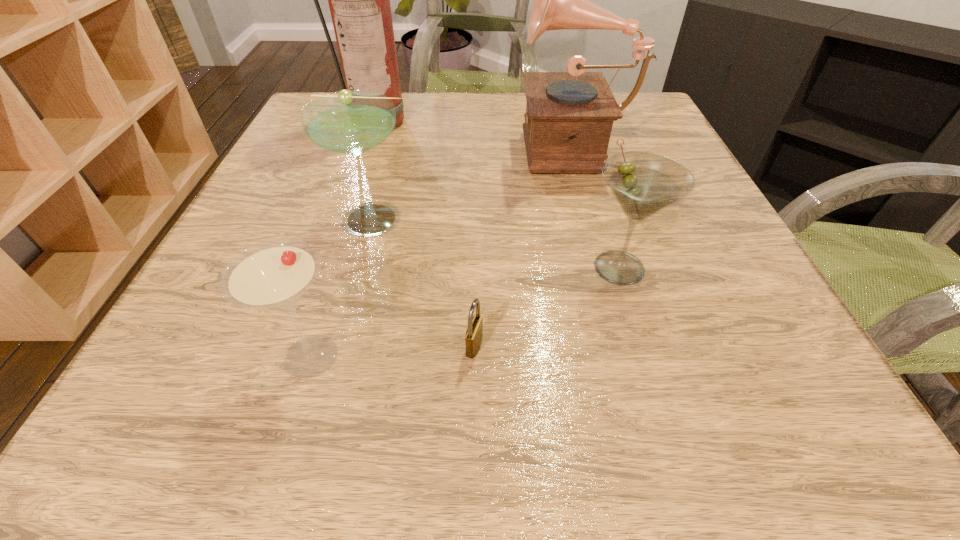
Find the location of a particular element. unoccupied position between the second tallest object and the padlock is located at coordinates (523, 245).

You are a GUI agent. You are given a task and a screenshot of the screen. Output one action in this format:
    pyautogui.click(x=<x>, y=<y>)
    Task: Click on the blank region between the nearest martini and the shortest object
    This screenshot has width=960, height=540.
    Given the screenshot: What is the action you would take?
    pyautogui.click(x=393, y=351)

Find the location of `free spot between the padlock and the second tallest object`. free spot between the padlock and the second tallest object is located at coordinates (523, 245).

Where is `free spot between the rightmost martini and the shortest object`? Image resolution: width=960 pixels, height=540 pixels. free spot between the rightmost martini and the shortest object is located at coordinates (547, 307).

Locate an element on the screen. Image resolution: width=960 pixels, height=540 pixels. free point between the shortest object and the record player is located at coordinates (523, 245).

This screenshot has height=540, width=960. In order to click on free space between the rightmost martini and the fourth object from left to right in this screenshot , I will do `click(547, 307)`.

Image resolution: width=960 pixels, height=540 pixels. Find the location of `empty space between the padlock and the record player`. empty space between the padlock and the record player is located at coordinates (523, 245).

This screenshot has width=960, height=540. Identify the location of vacant area between the rightmost martini and the third object from right to left. (547, 307).

Point out which object is positioned as the fourth nearest to the second tallest object. Please provide its 2D coordinates. Your answer should be formatted as a tuple, i.e. [(x, y)], where the tuple contains the x and y coordinates of a point satisfying the conditions above.

[(474, 334)]

Identify which object is located as the third nearest to the record player. Please provide its 2D coordinates. Your answer should be formatted as a tuple, i.e. [(x, y)], where the tuple contains the x and y coordinates of a point satisfying the conditions above.

[(359, 0)]